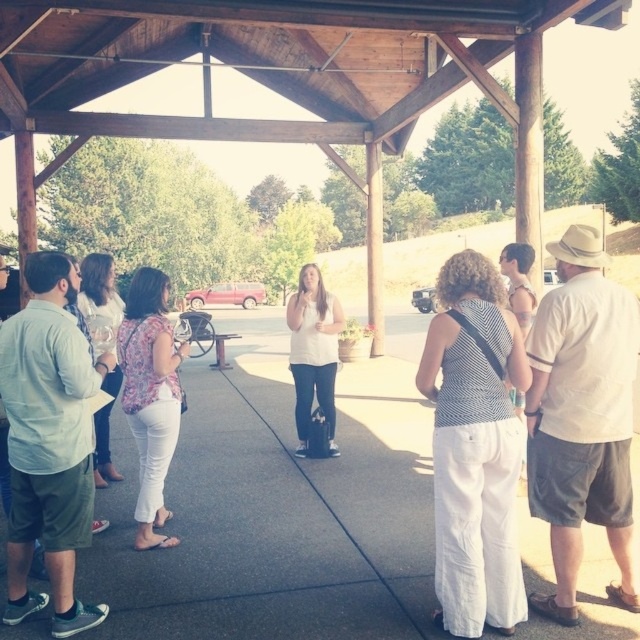
Question: Which of the following is the farthest from the observer?

Choices:
 (A) (305, 355)
 (B) (140, 394)

Answer: (A)

Question: In this image, where is floral fabric blouse at center located relative to white matte shirt at center?

Choices:
 (A) right
 (B) left

Answer: (B)

Question: Is floral fabric blouse at center behind white matte shirt at center?

Choices:
 (A) yes
 (B) no

Answer: (B)

Question: Which point appears farthest from the camera in this image?

Choices:
 (A) (141, 484)
 (B) (312, 276)

Answer: (B)

Question: From the image, what is the correct spatial relationship of floral fabric blouse at center in relation to white matte shirt at center?

Choices:
 (A) above
 (B) below

Answer: (B)